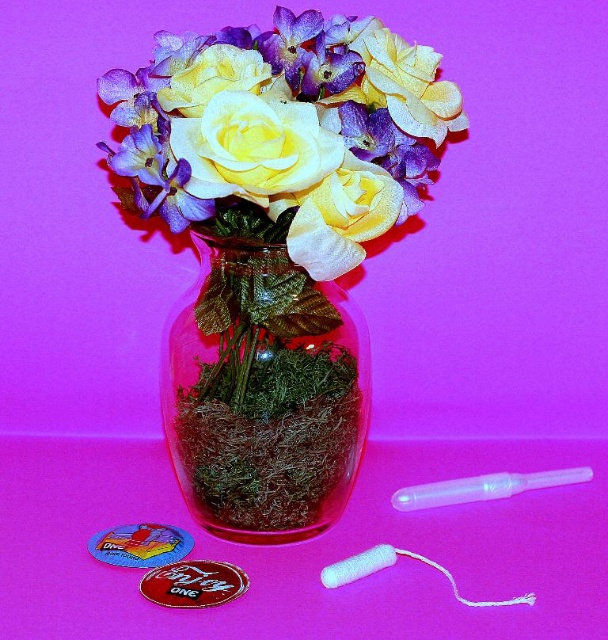
You are an interior designer arranging flowers in a vase. You have two yellow roses to place in the vase. The first is a matte yellow rose at center and the second is a matte yellow fabric rose at center. Which one should you choose if you want the flower to be larger?

You should choose the matte yellow fabric rose at center because it is larger than the matte yellow rose at center.

You are arranging flowers in a transparent glass vase at center and placing a matte yellow rose at center. Which object is positioned higher in the image?

The matte yellow rose at center is positioned higher than the transparent glass vase at center according to the description.